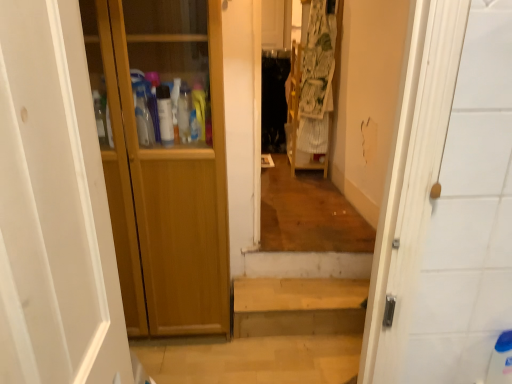
What do you see at coordinates (167, 167) in the screenshot? The image size is (512, 384). I see `wooden cabinet at left` at bounding box center [167, 167].

What do you see at coordinates (298, 306) in the screenshot? This screenshot has height=384, width=512. I see `wooden stairs at center` at bounding box center [298, 306].

Describe the element at coordinates (274, 336) in the screenshot. This screenshot has height=384, width=512. I see `wooden cabinet at left` at that location.

I want to click on wooden cabinet at left, so click(167, 167).

How much distance is there between printed fabric laundry at center and wooden cabinet at left?

They are 4.74 feet apart.

Looking at this image, what's the angular difference between printed fabric laundry at center and wooden cabinet at left's facing directions?

0.769 degrees.

Looking at their sizes, would you say printed fabric laundry at center is wider or thinner than wooden cabinet at left?

Clearly, printed fabric laundry at center has less width compared to wooden cabinet at left.

Is printed fabric laundry at center at the left side of wooden cabinet at left?

No, printed fabric laundry at center is not to the left of wooden cabinet at left.

From the image's perspective, relative to printed fabric laundry at center, is wooden cabinet at left above or below?

wooden cabinet at left is situated lower than printed fabric laundry at center in the image.

This screenshot has width=512, height=384. In order to click on laundry lying on the right of wooden cabinet at left in this screenshot , I will do `click(317, 79)`.

Is wooden cabinet at left far from printed fabric laundry at center?

Yes, wooden cabinet at left and printed fabric laundry at center are quite far apart.

Between wooden cabinet at left and printed fabric laundry at center, which one has smaller width?

printed fabric laundry at center.

How many degrees apart are the facing directions of wooden stairs at center and printed fabric laundry at center?

The facing directions of wooden stairs at center and printed fabric laundry at center are 1.27 degrees apart.

From the image's perspective, is wooden stairs at center over printed fabric laundry at center?

No, from the image's perspective, wooden stairs at center is not above printed fabric laundry at center.

Based on the photo, can you confirm if wooden stairs at center is taller than printed fabric laundry at center?

No.

Can you confirm if printed fabric laundry at center is wider than wooden stairs at center?

No.

Which object is positioned more to the left, printed fabric laundry at center or wooden stairs at center?

wooden stairs at center is more to the left.

Is printed fabric laundry at center positioned far away from wooden stairs at center?

printed fabric laundry at center is far away from wooden stairs at center.

How different are the orientations of printed fabric laundry at center and wooden stairs at center in degrees?

The angular difference between printed fabric laundry at center and wooden stairs at center is 1.27 degrees.

From the image's perspective, is wooden cabinet at left beneath wooden stairs at center?

Correct, wooden cabinet at left appears lower than wooden stairs at center in the image.

Considering the positions of points (245, 312) and (320, 299), is point (245, 312) farther from camera compared to point (320, 299)?

No, it is in front of (320, 299).

Is wooden cabinet at left not close to wooden stairs at center?

No.

Considering the positions of objects wooden cabinet at left and wooden stairs at center in the image provided, who is behind, wooden cabinet at left or wooden stairs at center?

wooden stairs at center is further from the camera.

Is wooden cabinet at left in contact with wooden cabinet at left?

No.

Considering the sizes of objects wooden cabinet at left and wooden cabinet at left in the image provided, who is wider, wooden cabinet at left or wooden cabinet at left?

Wider between the two is wooden cabinet at left.

Is wooden cabinet at left behind wooden cabinet at left?

Yes, it is.

Between wooden cabinet at left and printed fabric laundry at center, which one has larger size?

With larger size is printed fabric laundry at center.

Is wooden cabinet at left to the left or to the right of printed fabric laundry at center in the image?

Based on their positions, wooden cabinet at left is located to the left of printed fabric laundry at center.

Based on the photo, is wooden cabinet at left inside or outside of printed fabric laundry at center?

wooden cabinet at left is located beyond the bounds of printed fabric laundry at center.

Which of these two, wooden cabinet at left or printed fabric laundry at center, stands shorter?

wooden cabinet at left is shorter.

You are a GUI agent. You are given a task and a screenshot of the screen. Output one action in this format:
    pyautogui.click(x=<x>, y=<y>)
    Task: Click on the laundry that is behind the wooden cabinet at left
    This screenshot has width=512, height=384.
    Given the screenshot: What is the action you would take?
    pyautogui.click(x=317, y=79)

Where is `door below the printed fabric laundry at center (from the image's perspective)`? The height and width of the screenshot is (384, 512). door below the printed fabric laundry at center (from the image's perspective) is located at coordinates (167, 167).

From the image, which object appears to be nearer to wooden stairs at center, printed fabric laundry at center or wooden cabinet at left?

wooden cabinet at left is positioned closer to the anchor wooden stairs at center.

From the image, which object appears to be nearer to wooden cabinet at left, wooden cabinet at left or printed fabric laundry at center?

Among the two, wooden cabinet at left is located nearer to wooden cabinet at left.

Considering their positions, is printed fabric laundry at center positioned further to wooden stairs at center than wooden cabinet at left?

printed fabric laundry at center is further to wooden stairs at center.

Looking at the image, which one is located further to wooden cabinet at left, wooden cabinet at left or wooden stairs at center?

wooden stairs at center is further to wooden cabinet at left.

From the image, which object appears to be nearer to wooden cabinet at left, wooden cabinet at left or printed fabric laundry at center?

The object closer to wooden cabinet at left is wooden cabinet at left.

Looking at the image, which one is located further to wooden cabinet at left, wooden cabinet at left or wooden stairs at center?

wooden cabinet at left.

Estimate the real-world distances between objects in this image. Which object is further from wooden cabinet at left, wooden stairs at center or wooden cabinet at left?

Based on the image, wooden cabinet at left appears to be further to wooden cabinet at left.

Which object lies further to the anchor point wooden cabinet at left, wooden stairs at center or printed fabric laundry at center?

Based on the image, printed fabric laundry at center appears to be further to wooden cabinet at left.

At what (x,y) coordinates should I click in order to perform the action: click on door that lies between printed fabric laundry at center and wooden stairs at center from top to bottom. Please return your answer as a coordinate pair (x, y). Image resolution: width=512 pixels, height=384 pixels. Looking at the image, I should click on (167, 167).

Image resolution: width=512 pixels, height=384 pixels. I want to click on door that lies between printed fabric laundry at center and wooden cabinet at left from top to bottom, so click(167, 167).

Locate an element on the screen. stairwell between wooden cabinet at left and wooden cabinet at left from top to bottom is located at coordinates (298, 306).

The image size is (512, 384). In order to click on stairwell between printed fabric laundry at center and wooden cabinet at left from top to bottom in this screenshot , I will do `click(298, 306)`.